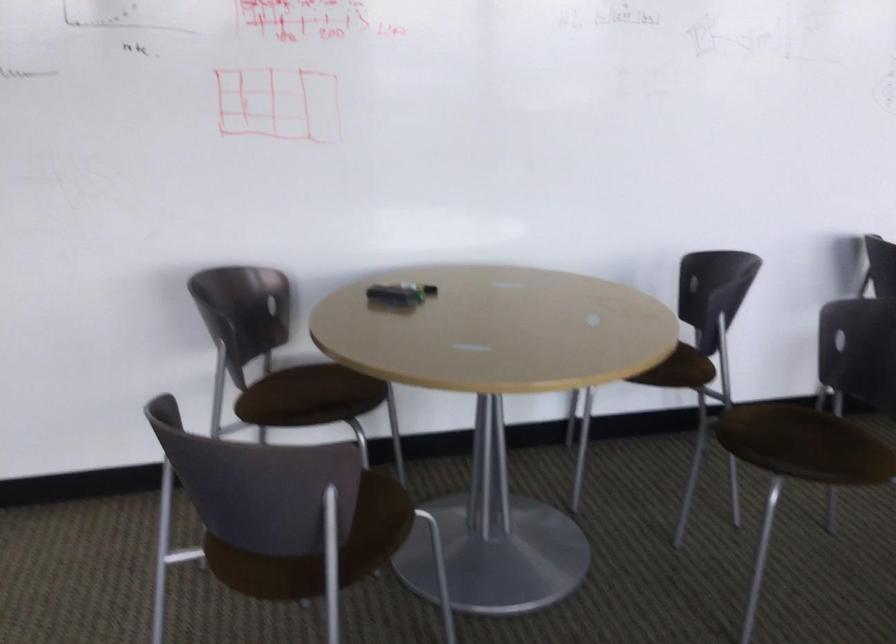
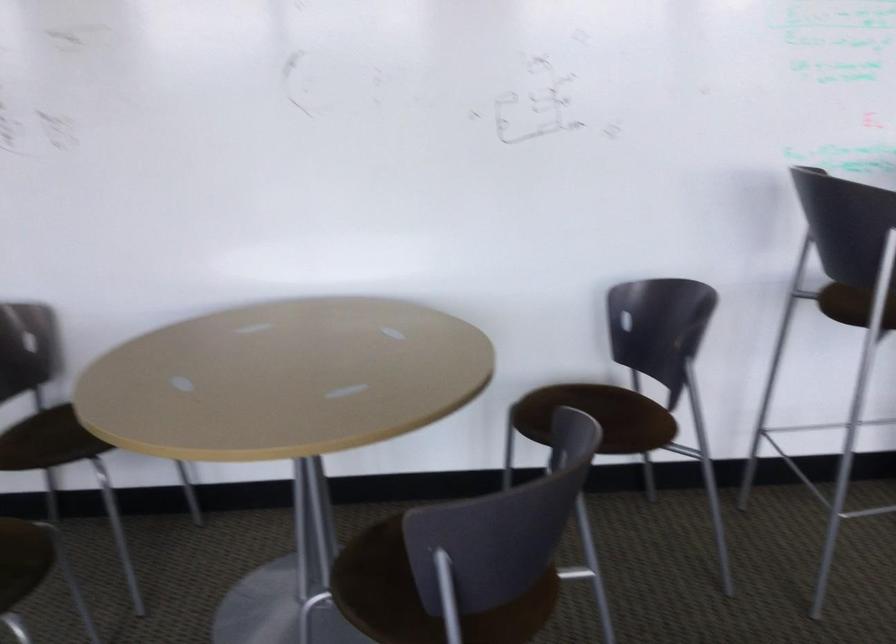
Question: In a continuous first-person perspective shot, in which direction is the camera moving?

Choices:
 (A) Left
 (B) Right
 (C) Forward
 (D) Backward

Answer: (B)